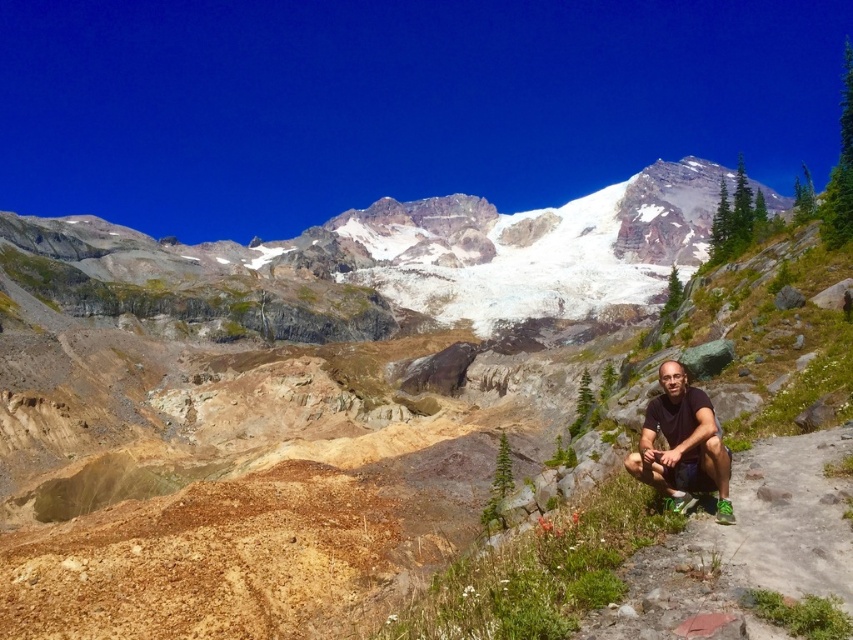
Based on the photo, you are standing at the bottom of the image and want to look towards the white rocky mountain at upper center. In which general direction should you turn your head?

The white rocky mountain at upper center is located at point (437, 250) in the image, which is to the left of the center. Therefore, you should turn your head to the left to look towards it.

You are standing at the location of the matte black shorts at lower right and want to climb the white rocky mountain at upper center. Which direction should you head to reach the mountain?

The white rocky mountain at upper center is to the right of the matte black shorts at lower right, so you should head to the right to reach the mountain.

You are a hiker trying to take a photo of the white rocky mountain at upper center without any obstructions. Is the matte black shorts at lower right blocking your view of the mountain?

The matte black shorts at lower right is behind the white rocky mountain at upper center, so it is not blocking your view of the mountain.